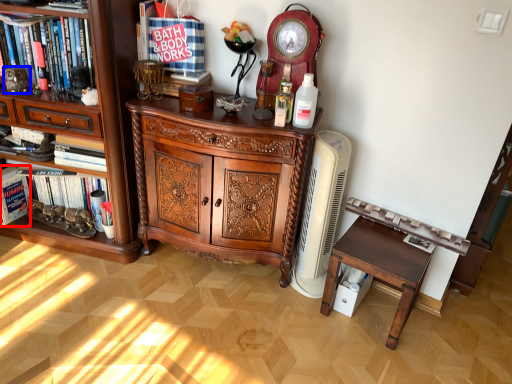
Question: Among these objects, which one is farthest to the camera, book (highlighted by a red box) or toy (highlighted by a blue box)?

Choices:
 (A) book
 (B) toy

Answer: (A)